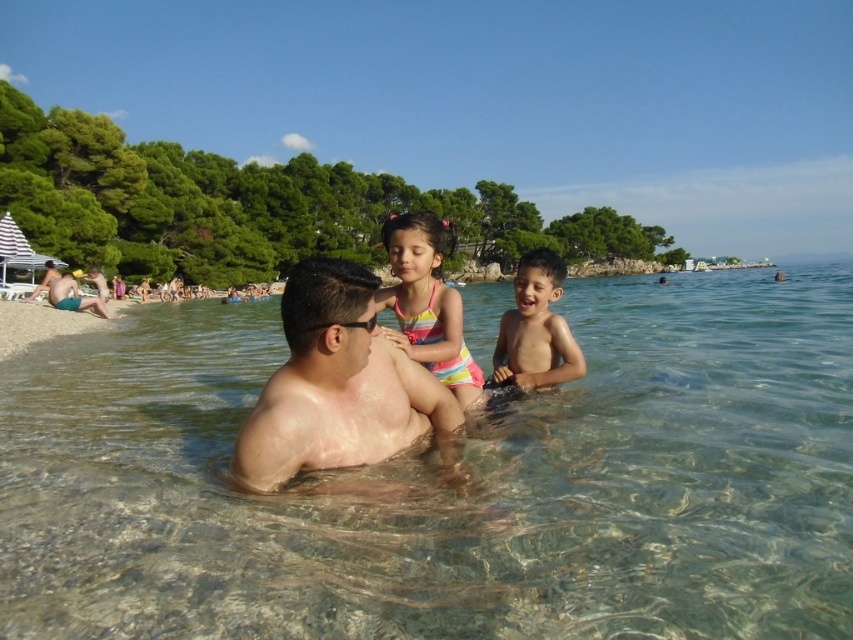
You are planning to take a photo of the clear water at center and the smooth skin man at center. Since you want both to be in focus, which object should you focus on to ensure the larger one is sharp?

The clear water at center has a larger size compared to the smooth skin man at center, so you should focus on the clear water at center to ensure it is sharp.